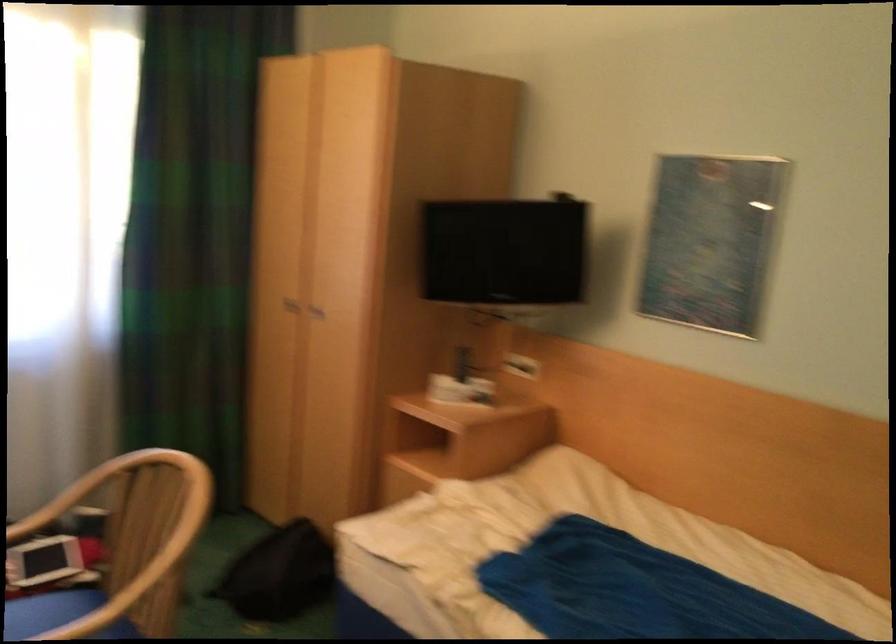
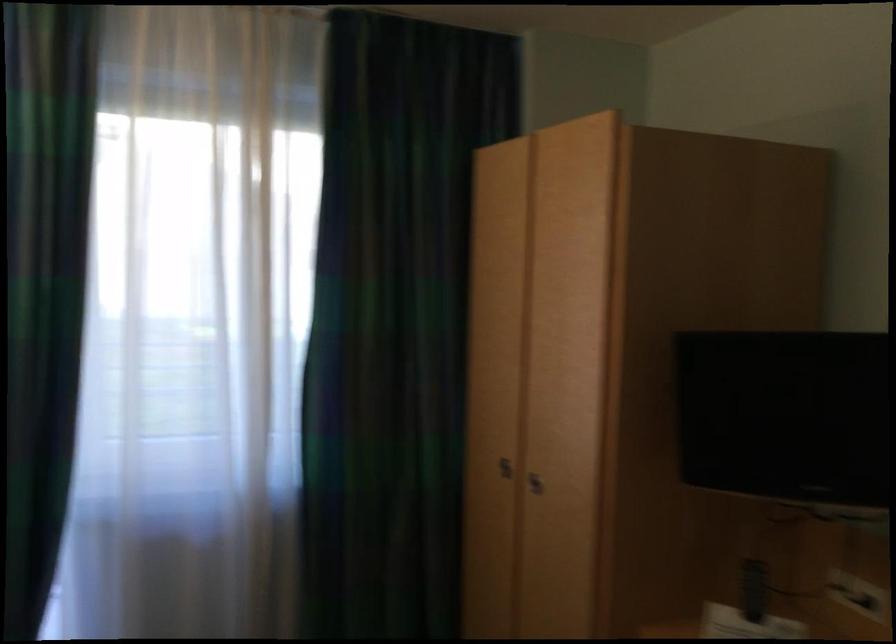
The point at (466, 366) is marked in the first image. Where is the corresponding point in the second image?

(754, 589)